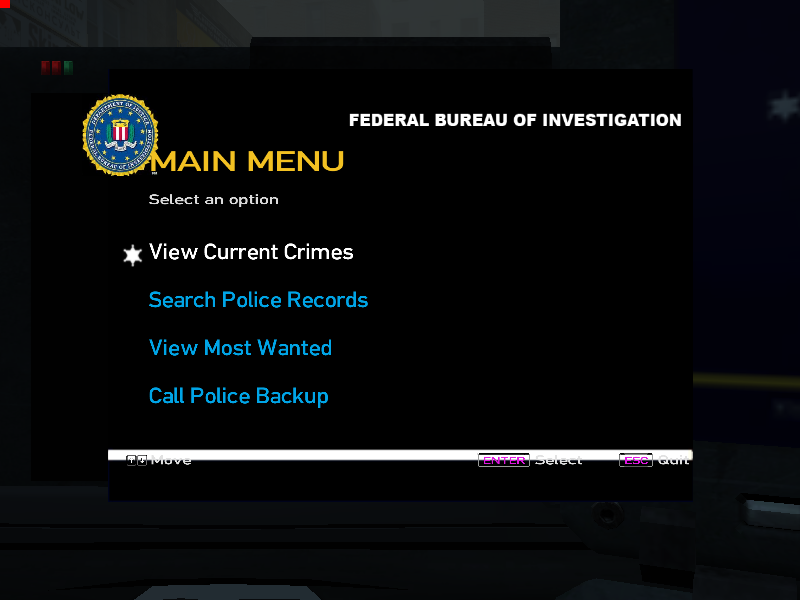
Find the location of `white bar`. white bar is located at coordinates (274, 452).